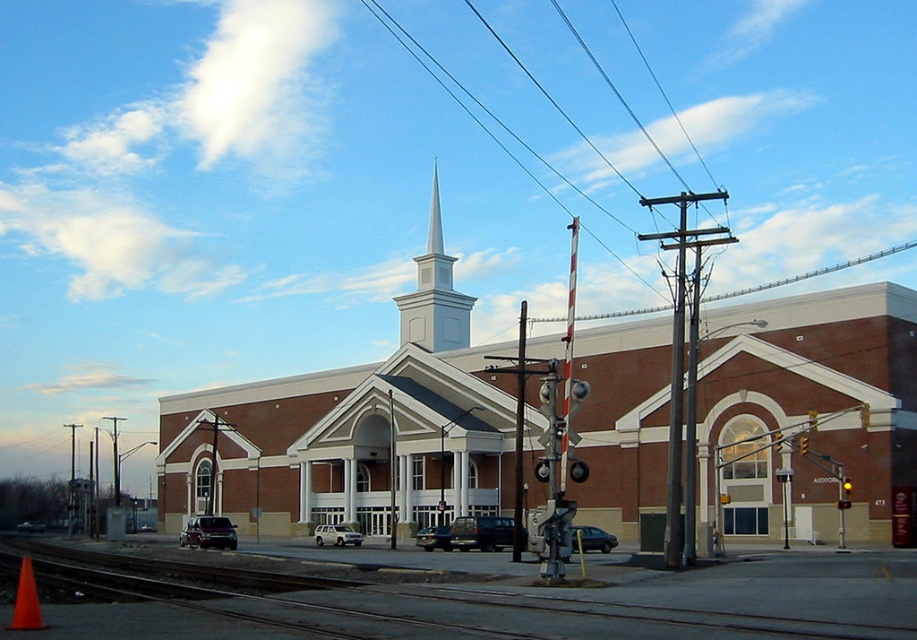
You are standing at the point marked by the coordinates point (x=354, y=429). What is the nearest major architectural feature of the brick building at center?

The point (x=354, y=429) is located at the center of the brick building at center, so the nearest major architectural feature would be its prominent white steeple at its center.

You are a photographer standing in front of the church and want to capture both the white smooth steeple at center and the yellow matte traffic light at center right in your photo. Which object will appear wider in the photo?

The white smooth steeple at center will appear wider in the photo because its width surpasses that of the yellow matte traffic light at center right.

Based on the photo, you are a photographer planning to capture the church and the railroad tracks in a single shot. Given that the brick building at center and the smooth wire at upper center must both be visible, which object should you focus on to ensure both are in frame?

You should focus on the brick building at center since it is bigger than the smooth wire at upper center, ensuring that both objects will fit within the frame when centered on the larger object.